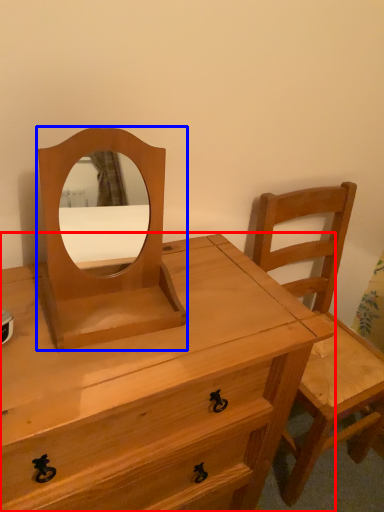
Question: Which of the following is the farthest to the observer, chest of drawers (highlighted by a red box) or mirror (highlighted by a blue box)?

Choices:
 (A) chest of drawers
 (B) mirror

Answer: (B)